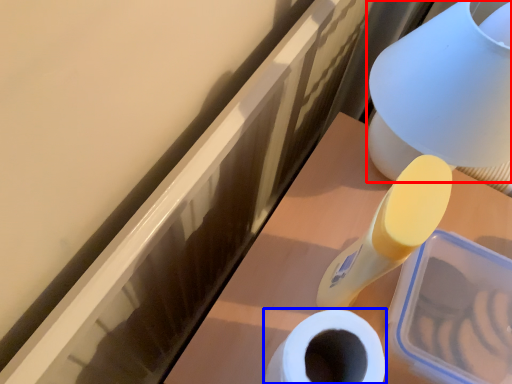
Question: Which object is further to the camera taking this photo, table lamp (highlighted by a red box) or toilet paper (highlighted by a blue box)?

Choices:
 (A) table lamp
 (B) toilet paper

Answer: (B)